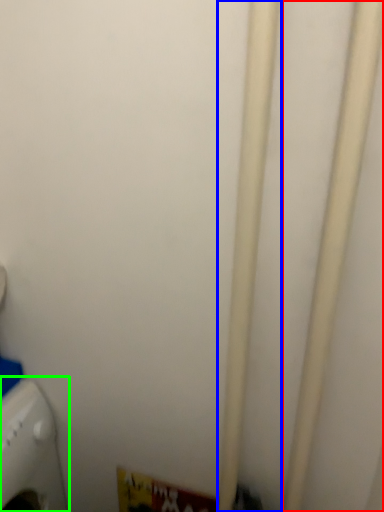
Question: Estimate the real-world distances between objects in this image. Which object is closer to pipe (highlighted by a red box), pipe (highlighted by a blue box) or home appliance (highlighted by a green box)?

Choices:
 (A) pipe
 (B) home appliance

Answer: (A)